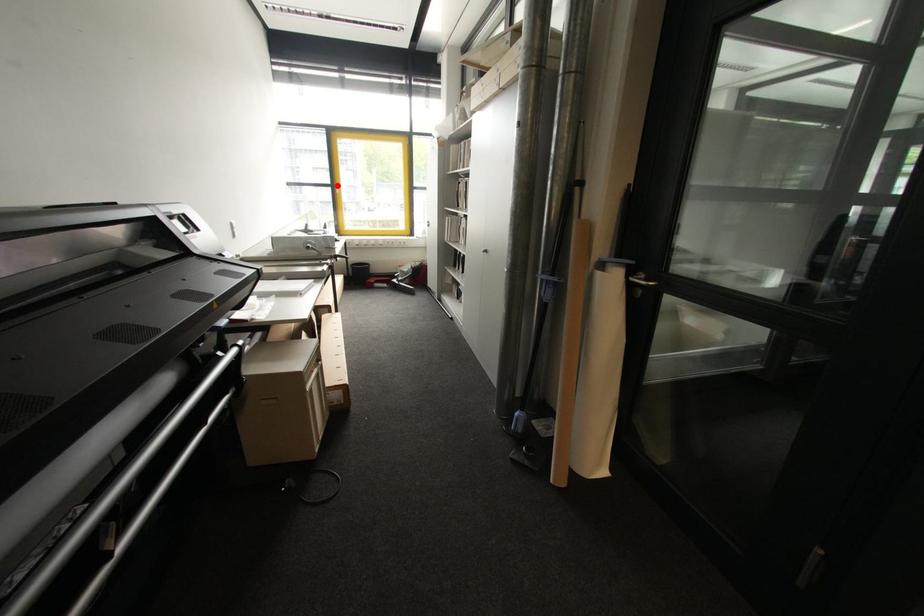
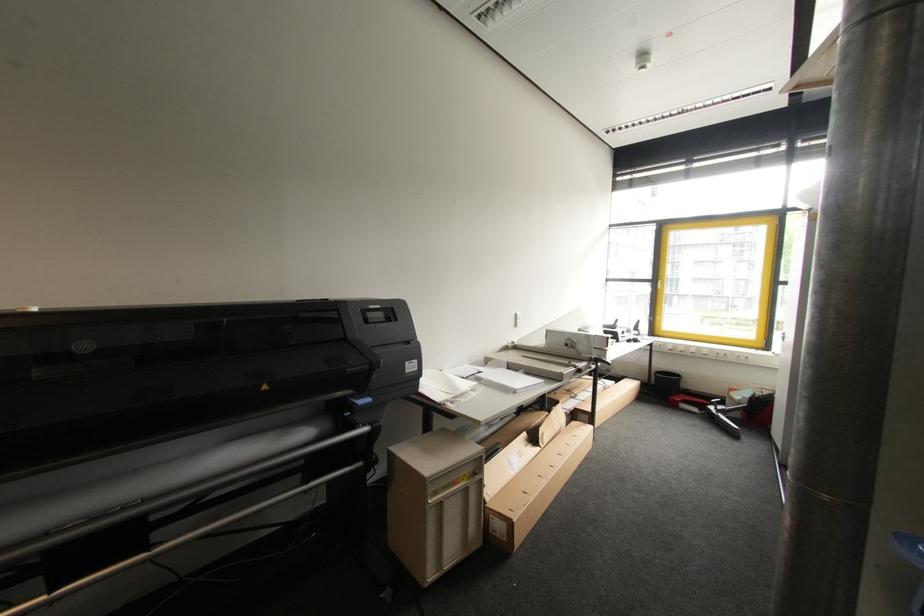
Locate, in the second image, the point that corresponds to the highlighted location in the first image.

(660, 281)